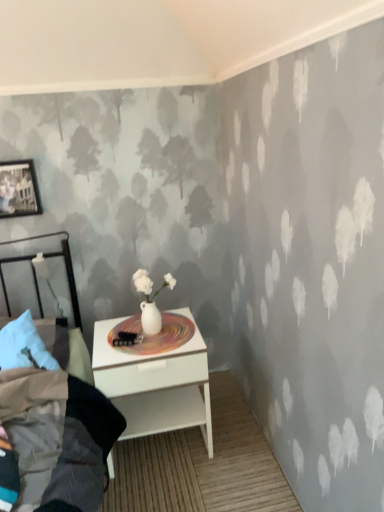
Locate an element on the screen. This screenshot has width=384, height=512. free space in front of white glossy nightstand at lower center is located at coordinates (174, 489).